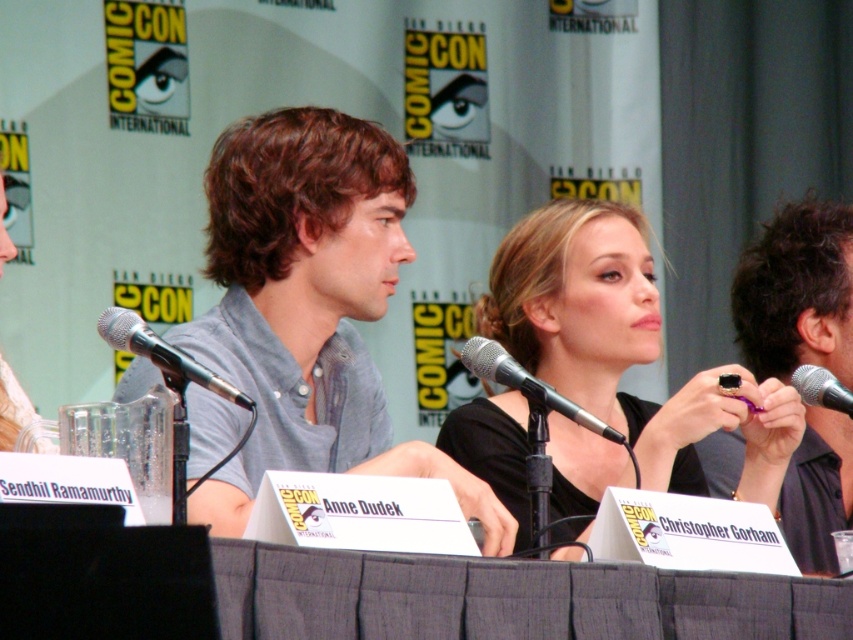
Which of these two, gray cotton shirt at center or black metallic microphone at right, stands shorter?

black metallic microphone at right is shorter.

This screenshot has height=640, width=853. I want to click on gray cotton shirt at center, so point(310,307).

Between point (291, 406) and point (196, 378), which one is positioned in front?

Point (196, 378)

How far apart are gray cotton shirt at center and silver metallic microphone at left?

The distance of gray cotton shirt at center from silver metallic microphone at left is 31.14 inches.

Which is behind, point (318, 470) or point (140, 333)?

Point (318, 470)

Find the location of a particular element. gray cotton shirt at center is located at coordinates (310, 307).

Find the location of `silver metallic microphone at left`. silver metallic microphone at left is located at coordinates (164, 355).

Can you confirm if silver metallic microphone at left is positioned below black metallic microphone at right?

No.

Does point (183, 380) come closer to viewer compared to point (825, 374)?

Yes, it is.

The height and width of the screenshot is (640, 853). In order to click on silver metallic microphone at left in this screenshot , I will do `click(164, 355)`.